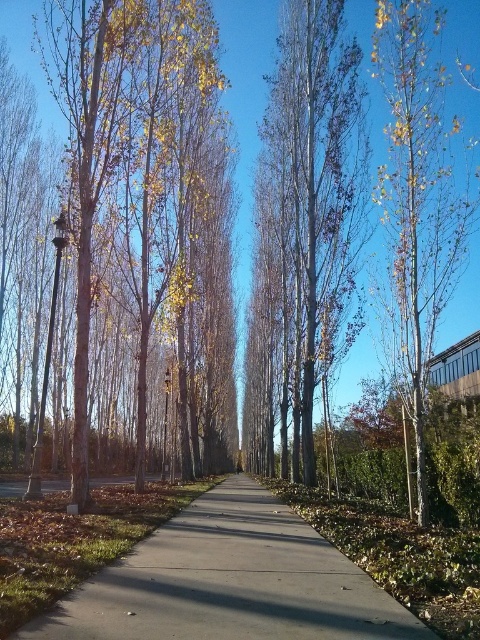
Question: Is yellow-green foliage at center closer to the viewer compared to smooth white birch at right?

Choices:
 (A) no
 (B) yes

Answer: (A)

Question: Is smooth silver birch tree at center above smooth white birch at right?

Choices:
 (A) no
 (B) yes

Answer: (A)

Question: Estimate the real-world distances between objects in this image. Which object is farther from the smooth silver birch tree at center?

Choices:
 (A) yellow-green foliage at center
 (B) smooth white birch at right

Answer: (B)

Question: Does yellow-green foliage at center have a smaller size compared to smooth white birch at right?

Choices:
 (A) yes
 (B) no

Answer: (B)

Question: Which point is closer to the camera taking this photo?

Choices:
 (A) (403, 24)
 (B) (208, 520)
 (C) (333, 218)

Answer: (B)

Question: Which of the following is the farthest from the observer?

Choices:
 (A) (232, 394)
 (B) (346, 147)
 (C) (463, 250)

Answer: (A)